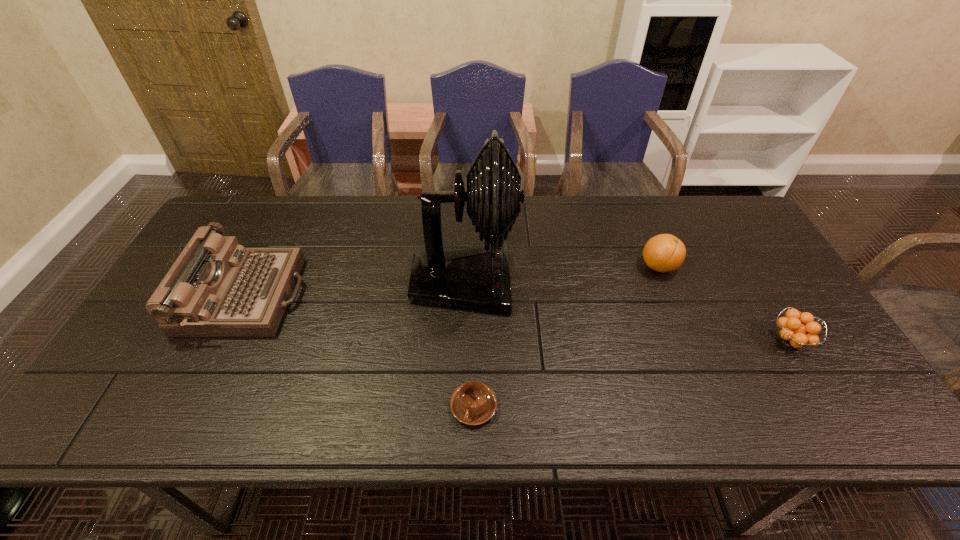
In the image, there is a desktop. Where is `vacant space at the far right corner`? This screenshot has height=540, width=960. vacant space at the far right corner is located at coordinates (720, 222).

Where is `vacant space at the near right corner`? This screenshot has height=540, width=960. vacant space at the near right corner is located at coordinates (851, 411).

At what (x,y) coordinates should I click in order to perform the action: click on empty space between the shorter orange fruit and the shortest object. Please return your answer as a coordinate pair (x, y). The width and height of the screenshot is (960, 540). Looking at the image, I should click on (632, 374).

Find the location of a particular element. free area in between the nearest object and the tallest object is located at coordinates (469, 345).

Locate an element on the screen. The width and height of the screenshot is (960, 540). empty space that is in between the right orange fruit and the tallest object is located at coordinates (628, 312).

I want to click on vacant area that lies between the leftmost object and the fan, so pos(355,289).

Image resolution: width=960 pixels, height=540 pixels. I want to click on vacant area that lies between the farther orange fruit and the nearest object, so click(x=566, y=336).

This screenshot has width=960, height=540. Identify the location of vacant area that lies between the rightmost object and the leftmost object. pyautogui.click(x=518, y=319).

Image resolution: width=960 pixels, height=540 pixels. What are the coordinates of `free point between the leftmost object and the right orange fruit` in the screenshot? It's located at (518, 319).

Locate an element on the screen. The height and width of the screenshot is (540, 960). free space between the third tallest object and the right orange fruit is located at coordinates (725, 304).